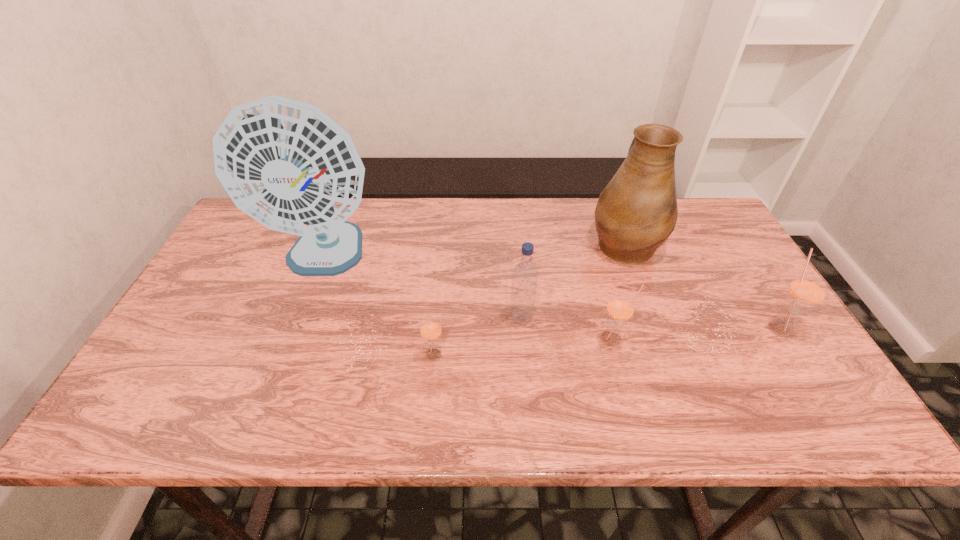
The height and width of the screenshot is (540, 960). In order to click on free space located on the back of the second object from left to right in this screenshot , I will do `click(443, 275)`.

This screenshot has width=960, height=540. In order to click on vacant space located on the front of the second straw from left to right in this screenshot , I will do `click(624, 384)`.

You are a GUI agent. You are given a task and a screenshot of the screen. Output one action in this format:
    pyautogui.click(x=<x>, y=<y>)
    Task: Click on the vacant space located on the left of the rightmost object
    
    Given the screenshot: What is the action you would take?
    pyautogui.click(x=744, y=327)

In order to click on vacant area situated 0.070m on the handle side of the pitcher in this screenshot , I will do `click(611, 206)`.

You are a GUI agent. You are given a task and a screenshot of the screen. Output one action in this format:
    pyautogui.click(x=<x>, y=<y>)
    Task: Click on the blank area located on the grille of the fan
    
    Given the screenshot: What is the action you would take?
    pyautogui.click(x=295, y=336)

This screenshot has width=960, height=540. I want to click on free space located 0.260m on the right of the fourth object from right to left, so click(636, 319).

Locate an element on the screen. pitcher that is at the far edge is located at coordinates (636, 212).

Where is `fan at the far edge`? The image size is (960, 540). fan at the far edge is located at coordinates (287, 164).

I want to click on object located in the near edge section of the desktop, so click(x=430, y=328).

Where is `object at the left edge`? This screenshot has height=540, width=960. object at the left edge is located at coordinates (287, 164).